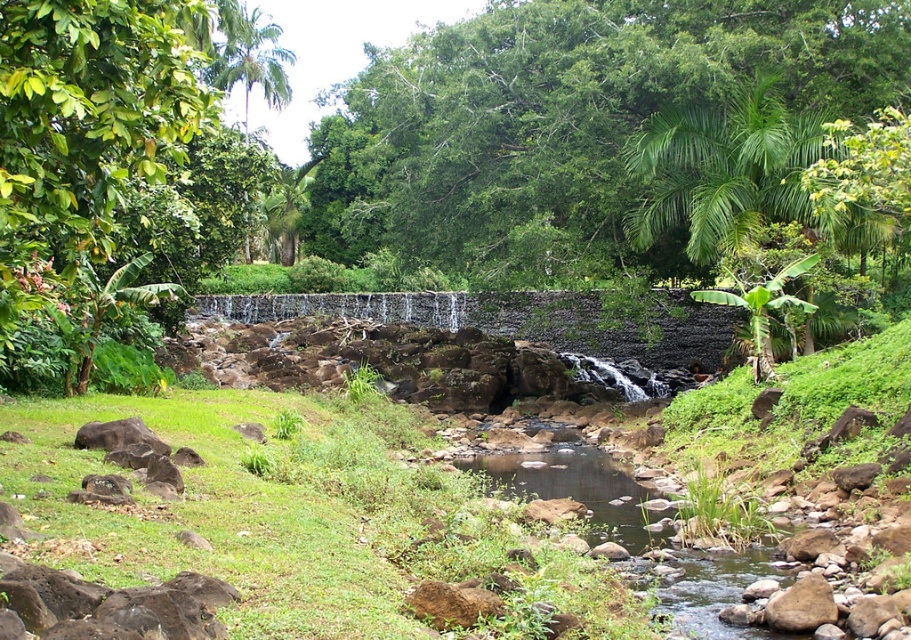
Who is more forward, (128,141) or (254,24)?

Positioned in front is point (128,141).

Measure the distance from green leafy tree at upper left to green leafy palm tree at upper left.

The distance of green leafy tree at upper left from green leafy palm tree at upper left is 31.13 meters.

Identify the location of green leafy tree at upper left. This screenshot has height=640, width=911. (83, 163).

Where is `green leafy tree at upper left`? green leafy tree at upper left is located at coordinates (83, 163).

Looking at this image, is gray stone waterfall at center in front of green leafy palm tree at upper left?

Yes, it is in front of green leafy palm tree at upper left.

Who is lower down, gray stone waterfall at center or green leafy palm tree at upper left?

gray stone waterfall at center is lower down.

Where is `gray stone waterfall at center`? The image size is (911, 640). gray stone waterfall at center is located at coordinates (340, 307).

Image resolution: width=911 pixels, height=640 pixels. What are the coordinates of `gray stone waterfall at center` in the screenshot? It's located at (340, 307).

Between point (546, 125) and point (220, 88), which one is positioned in front?

Positioned in front is point (546, 125).

Is point (791, 33) in front of point (238, 49)?

Yes, it is.

Where is `green leafy tree at upper center`? The image size is (911, 640). green leafy tree at upper center is located at coordinates (566, 124).